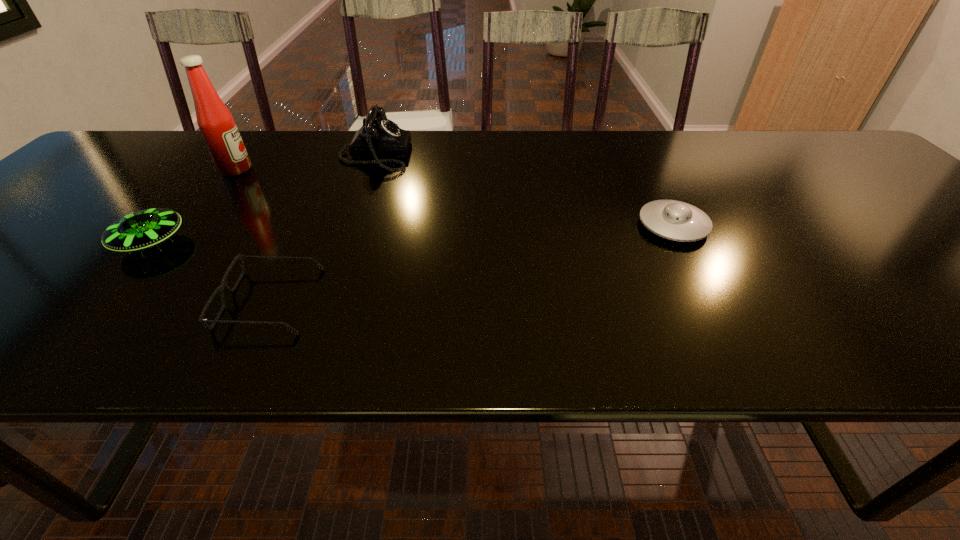
Locate an element on the screen. The width and height of the screenshot is (960, 540). empty space between the second tallest object and the right saucer is located at coordinates (524, 190).

Locate an element on the screen. This screenshot has width=960, height=540. vacant area between the right saucer and the tallest object is located at coordinates (454, 198).

Locate an element on the screen. The width and height of the screenshot is (960, 540). free space between the fourth shortest object and the taller saucer is located at coordinates [x=263, y=199].

Point out which object is positioned as the nearest to the nearest object. Please provide its 2D coordinates. Your answer should be formatted as a tuple, i.e. [(x, y)], where the tuple contains the x and y coordinates of a point satisfying the conditions above.

[(142, 229)]

Locate an element on the screen. Image resolution: width=960 pixels, height=540 pixels. object that is the fourth closest to the spectacles is located at coordinates (674, 220).

The height and width of the screenshot is (540, 960). What are the coordinates of `vacant region that satisfies the following two spatial constraints: 1. on the back side of the taller saucer; 2. on the right side of the shorter saucer` in the screenshot? It's located at (166, 226).

Find the location of a particular element. This screenshot has height=540, width=960. free spot that satisfies the following two spatial constraints: 1. on the dial of the telephone; 2. on the front side of the third tallest object is located at coordinates (342, 243).

This screenshot has width=960, height=540. In order to click on vacant space that satisfies the following two spatial constraints: 1. on the front-facing side of the condiment; 2. on the front-facing side of the nearest object in this screenshot , I will do `click(132, 300)`.

At what (x,y) coordinates should I click in order to perform the action: click on free point that satisfies the following two spatial constraints: 1. on the front-facing side of the tallest object; 2. on the front-facing side of the spectacles. Please return your answer as a coordinate pair (x, y). Looking at the image, I should click on (132, 300).

This screenshot has height=540, width=960. Identify the location of vacant position in the image that satisfies the following two spatial constraints: 1. on the front-facing side of the condiment; 2. on the front-facing side of the spectacles. (132, 300).